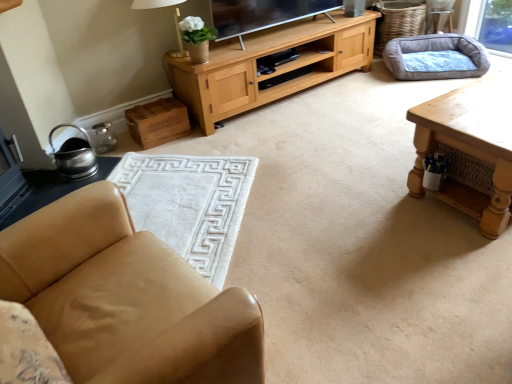
What are the coordinates of `free point to the left of wooden table at right` in the screenshot? It's located at (361, 197).